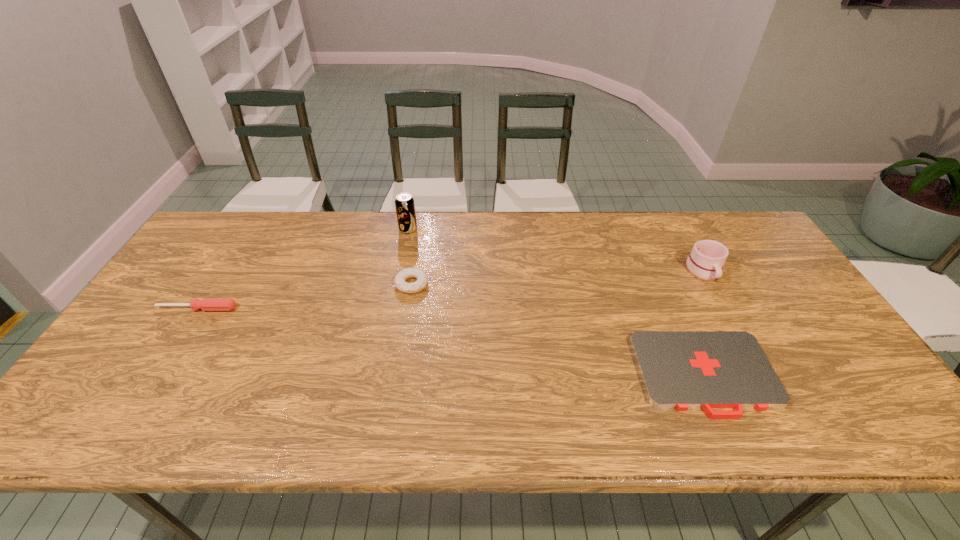
Locate an element on the screen. free space located 0.070m on the right of the doughnut is located at coordinates pyautogui.click(x=453, y=284).

Image resolution: width=960 pixels, height=540 pixels. I want to click on vacant point located on the right of the leftmost object, so click(x=365, y=308).

What are the coordinates of `object located in the far edge section of the desktop` in the screenshot? It's located at (404, 203).

This screenshot has height=540, width=960. Find the location of `object present at the near edge`. object present at the near edge is located at coordinates (679, 369).

Where is `object located in the left edge section of the desktop`? This screenshot has width=960, height=540. object located in the left edge section of the desktop is located at coordinates (206, 304).

Where is `vacant area at the far edge of the desktop`? vacant area at the far edge of the desktop is located at coordinates (660, 230).

Identify the location of vacant space at the near edge of the desktop. (297, 429).

I want to click on vacant region at the left edge, so click(172, 290).

Locate an element on the screen. The image size is (960, 540). free space at the right edge of the desktop is located at coordinates (846, 360).

The image size is (960, 540). I want to click on free space at the near left corner of the desktop, so click(68, 436).